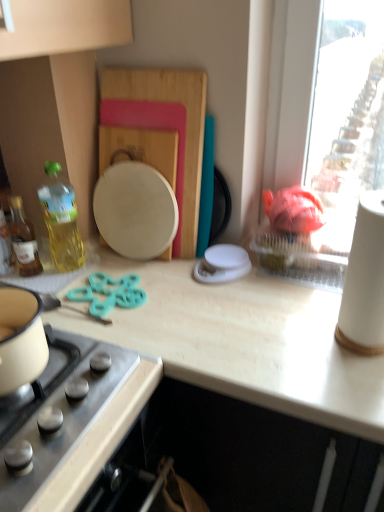
At what (x,y) coordinates should I click in order to perform the action: click on light wood countertop at center. Please return your answer as a coordinate pair (x, y). Looking at the image, I should click on (243, 341).

Is teal plastic scissors at center aimed at stainless steel gas stove at lower left?

No, teal plastic scissors at center is not aimed at stainless steel gas stove at lower left.

Consider the image. Are teal plastic scissors at center and stainless steel gas stove at lower left far apart?

No, teal plastic scissors at center is in close proximity to stainless steel gas stove at lower left.

Measure the distance between teal plastic scissors at center and stainless steel gas stove at lower left.

9.28 inches.

Between teal plastic scissors at center and stainless steel gas stove at lower left, which one has smaller width?

teal plastic scissors at center is thinner.

Would you say light wood countertop at center is inside or outside white paper towel at right?

light wood countertop at center is spatially situated outside white paper towel at right.

Can you confirm if light wood countertop at center is smaller than white paper towel at right?

Actually, light wood countertop at center might be larger than white paper towel at right.

Which object is closer to the camera, light wood countertop at center or white paper towel at right?

Positioned in front is light wood countertop at center.

Is white paper towel at right at the right side of translucent yellow bottle at left, acting as the 1th bottle starting from the left?

Indeed, white paper towel at right is positioned on the right side of translucent yellow bottle at left, acting as the 1th bottle starting from the left.

Who is bigger, white paper towel at right or translucent yellow bottle at left, the 2th bottle positioned from the right?

With larger size is white paper towel at right.

Is white paper towel at right surrounding translucent yellow bottle at left, the 2th bottle positioned from the right?

That's incorrect, translucent yellow bottle at left, the 2th bottle positioned from the right, is not inside white paper towel at right.

How distant is white paper towel at right from translucent yellow bottle at left, acting as the 1th bottle starting from the left?

white paper towel at right is 30.15 inches from translucent yellow bottle at left, acting as the 1th bottle starting from the left.

From a real-world perspective, is white paper towel at right on teal plastic scissors at center?

Correct, in the physical world, white paper towel at right is higher than teal plastic scissors at center.

Is white paper towel at right wider or thinner than teal plastic scissors at center?

white paper towel at right is thinner than teal plastic scissors at center.

Is white paper towel at right completely or partially outside of teal plastic scissors at center?

Yes, white paper towel at right is not within teal plastic scissors at center.

Considering the sizes of objects white paper towel at right and teal plastic scissors at center in the image provided, who is taller, white paper towel at right or teal plastic scissors at center?

white paper towel at right is taller.

Relative to translucent yellow bottle at left, the 2th bottle positioned from the right, is teal plastic scissors at center in front or behind?

teal plastic scissors at center is positioned closer to the viewer than translucent yellow bottle at left, the 2th bottle positioned from the right.

Find the location of a particular element. The width and height of the screenshot is (384, 512). scissors below the translucent yellow bottle at left, the 2th bottle positioned from the right (from a real-world perspective) is located at coordinates (109, 293).

From a real-world perspective, between teal plastic scissors at center and translucent yellow bottle at left, the 2th bottle positioned from the right, who is vertically higher?

In real-world perspective, translucent yellow bottle at left, the 2th bottle positioned from the right, is above.

Who is smaller, light wood countertop at center or stainless steel gas stove at lower left?

stainless steel gas stove at lower left is smaller.

From the image's perspective, between light wood countertop at center and stainless steel gas stove at lower left, which one is located above?

light wood countertop at center.

Where is `gas stove above the light wood countertop at center (from a real-world perspective)`? gas stove above the light wood countertop at center (from a real-world perspective) is located at coordinates (75, 422).

From their relative heights in the image, would you say translucent yellow bottle at left, the 2th bottle positioned from the right, is taller or shorter than white paper towel at right?

Considering their sizes, translucent yellow bottle at left, the 2th bottle positioned from the right, has less height than white paper towel at right.

Is translucent yellow bottle at left, the 2th bottle positioned from the right, not inside white paper towel at right?

Yes.

Is translucent yellow bottle at left, the 2th bottle positioned from the right, to the left of white paper towel at right from the viewer's perspective?

Correct, you'll find translucent yellow bottle at left, the 2th bottle positioned from the right, to the left of white paper towel at right.

Identify the location of scissors above the stainless steel gas stove at lower left (from the image's perspective). The image size is (384, 512). (109, 293).

This screenshot has height=512, width=384. Find the location of `countertop that is under the white paper towel at right (from a real-world perspective)`. countertop that is under the white paper towel at right (from a real-world perspective) is located at coordinates (243, 341).

From the picture: When comparing their distances from white paper towel at right, does translucent yellow bottle at left, acting as the 1th bottle starting from the left, or translucent yellow bottle at left, the 1th bottle viewed from the right, seem closer?

The object closer to white paper towel at right is translucent yellow bottle at left, the 1th bottle viewed from the right.

Considering their positions, is teal plastic scissors at center positioned further to translucent yellow bottle at left, acting as the 1th bottle starting from the left, than light wood countertop at center?

The object further to translucent yellow bottle at left, acting as the 1th bottle starting from the left, is light wood countertop at center.

Which object lies further to the anchor point white paper towel at right, translucent yellow bottle at left, acting as the 1th bottle starting from the left, or teal plastic scissors at center?

translucent yellow bottle at left, acting as the 1th bottle starting from the left, is positioned further to the anchor white paper towel at right.

Based on the photo, looking at the image, which one is located further to light wood countertop at center, translucent yellow bottle at left, acting as the 1th bottle starting from the left, or stainless steel gas stove at lower left?

The object further to light wood countertop at center is translucent yellow bottle at left, acting as the 1th bottle starting from the left.

Estimate the real-world distances between objects in this image. Which object is closer to translucent yellow bottle at left, acting as the 1th bottle starting from the left, light wood countertop at center or white paper towel at right?

Among the two, light wood countertop at center is located nearer to translucent yellow bottle at left, acting as the 1th bottle starting from the left.

Looking at the image, which one is located closer to stainless steel gas stove at lower left, teal plastic scissors at center or translucent yellow bottle at left, acting as the 1th bottle starting from the left?

The object closer to stainless steel gas stove at lower left is teal plastic scissors at center.

Estimate the real-world distances between objects in this image. Which object is further from stainless steel gas stove at lower left, translucent yellow bottle at left, the 2th bottle positioned from the right, or white paper towel at right?

white paper towel at right is positioned further to the anchor stainless steel gas stove at lower left.

In the scene shown: From the image, which object appears to be farther from translucent yellow bottle at left, the 2th bottle viewed from the left, white paper towel at right or translucent yellow bottle at left, the 2th bottle positioned from the right?

Based on the image, white paper towel at right appears to be further to translucent yellow bottle at left, the 2th bottle viewed from the left.

Find the location of a particular element. The image size is (384, 512). countertop situated between translucent yellow bottle at left, the 2th bottle viewed from the left, and white paper towel at right from left to right is located at coordinates (243, 341).

You are a GUI agent. You are given a task and a screenshot of the screen. Output one action in this format:
    pyautogui.click(x=<x>, y=<y>)
    Task: Click on the scissors that lies between translucent yellow bottle at left, the 2th bottle positioned from the right, and light wood countertop at center from top to bottom
    This screenshot has width=384, height=512.
    Given the screenshot: What is the action you would take?
    pyautogui.click(x=109, y=293)

What are the coordinates of `bottle between translucent yellow bottle at left, the 1th bottle viewed from the right, and stainless steel gas stove at lower left, in the vertical direction` in the screenshot? It's located at (23, 239).

At what (x,y) coordinates should I click in order to perform the action: click on gas stove situated between translucent yellow bottle at left, the 2th bottle viewed from the left, and white paper towel at right from left to right. Please return your answer as a coordinate pair (x, y). The image size is (384, 512). Looking at the image, I should click on (75, 422).